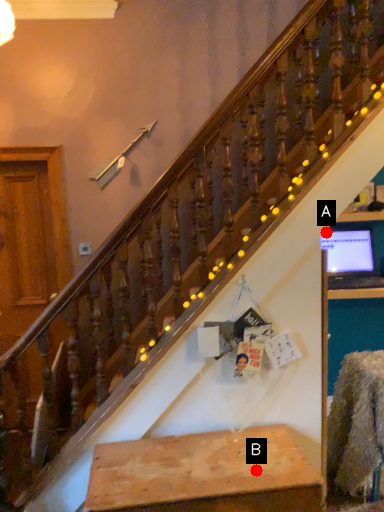
Question: Two points are circled on the image, labeled by A and B beside each circle. Which of the following is the farthest from the observer?

Choices:
 (A) A is further
 (B) B is further

Answer: (A)